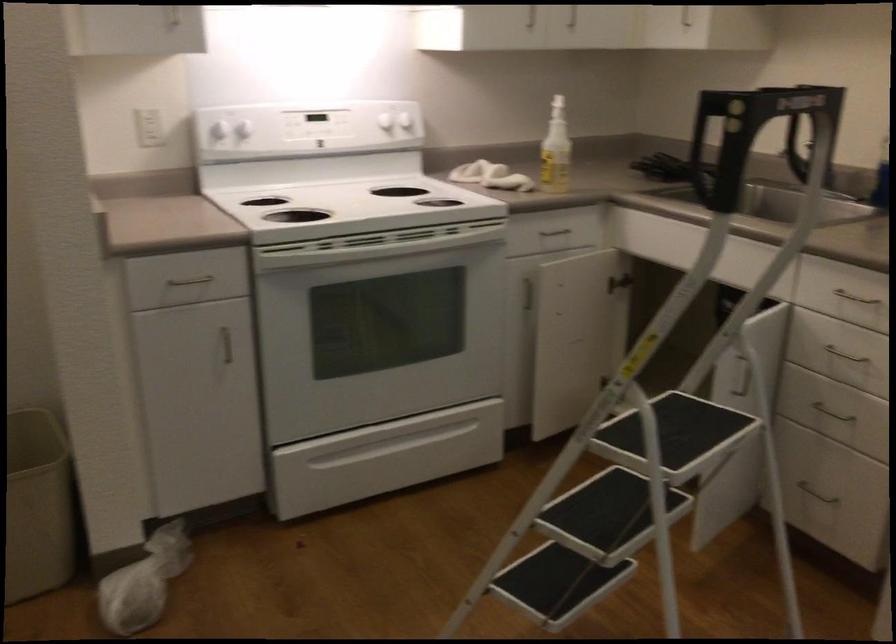
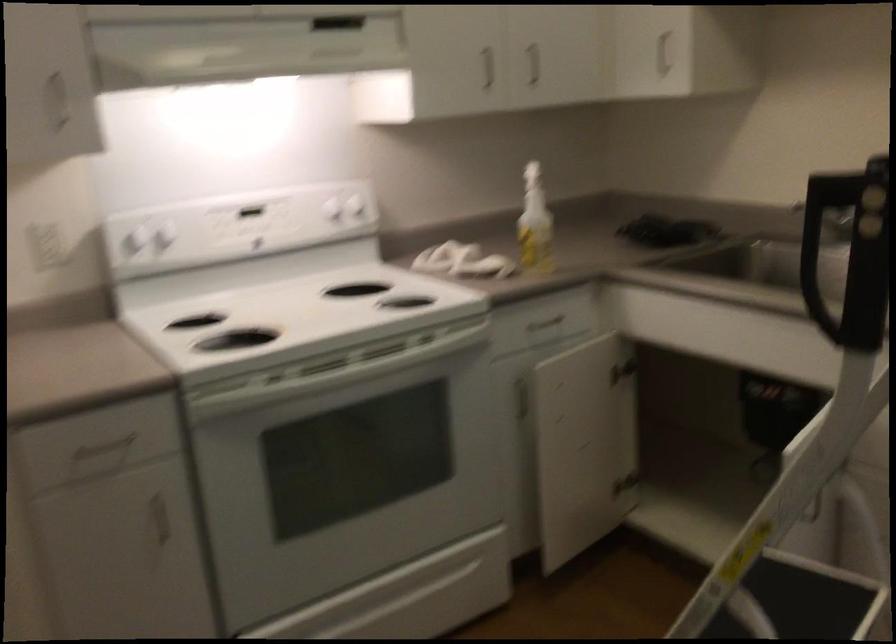
Locate, in the second image, the point that corresponds to the point at 565,342 in the first image.

(574, 448)